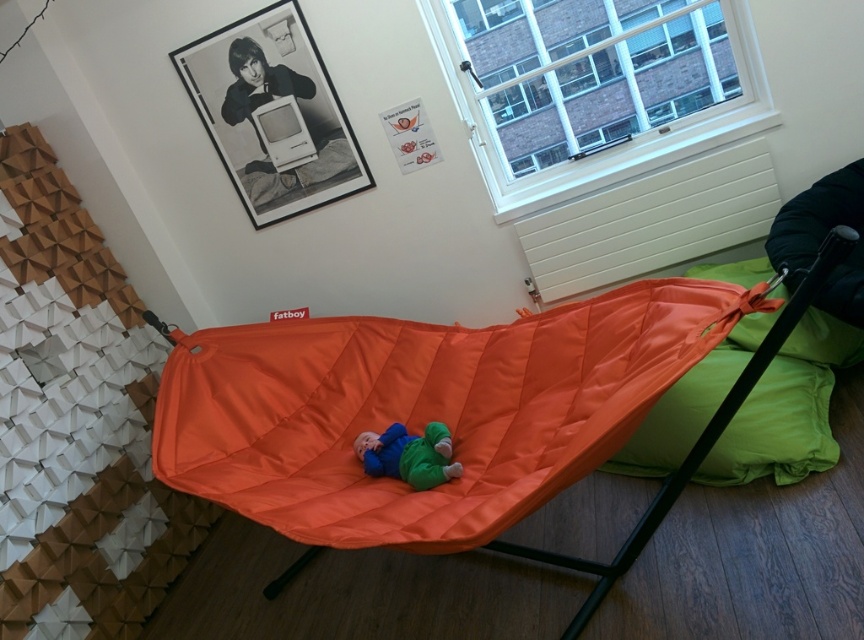
You are standing in the room and want to place a new decorative item on the green fabric pillow at lower right. What are the coordinates where you should place it?

The green fabric pillow at lower right is located at coordinates point (776, 428), so you should place the decorative item there.

You are a parent trying to place a small toy on top of either the orange fabric bean bag chair at right or the green fabric pillow at lower right. Which object can the toy be placed on without falling off?

The orange fabric bean bag chair at right is taller than the green fabric pillow at lower right, so the toy can be placed on the orange fabric bean bag chair at right without falling off.

You are a guest in this room and want to sit on the green fabric pillow at lower right. However, you notice another green fabric pillow at right. Which one is taller?

The green fabric pillow at lower right is much taller than the green fabric pillow at right.